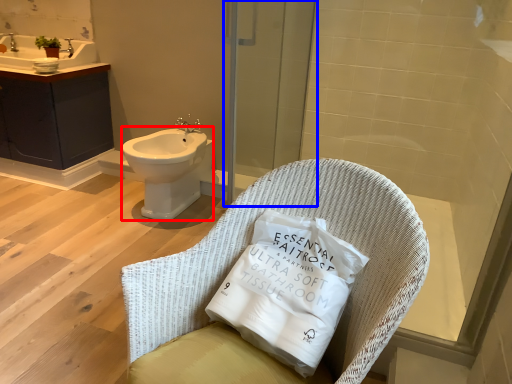
Question: Which of the following is the farthest to the observer, bidet (highlighted by a red box) or screen door (highlighted by a blue box)?

Choices:
 (A) bidet
 (B) screen door

Answer: (A)